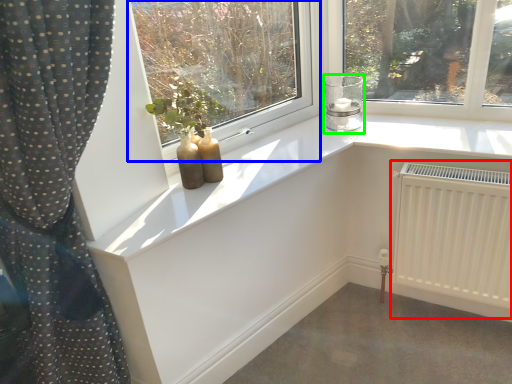
Question: Which object is positioned farthest from radiator (highlighted by a red box)? Select from window (highlighted by a blue box) and candle holder (highlighted by a green box).

Choices:
 (A) window
 (B) candle holder

Answer: (A)